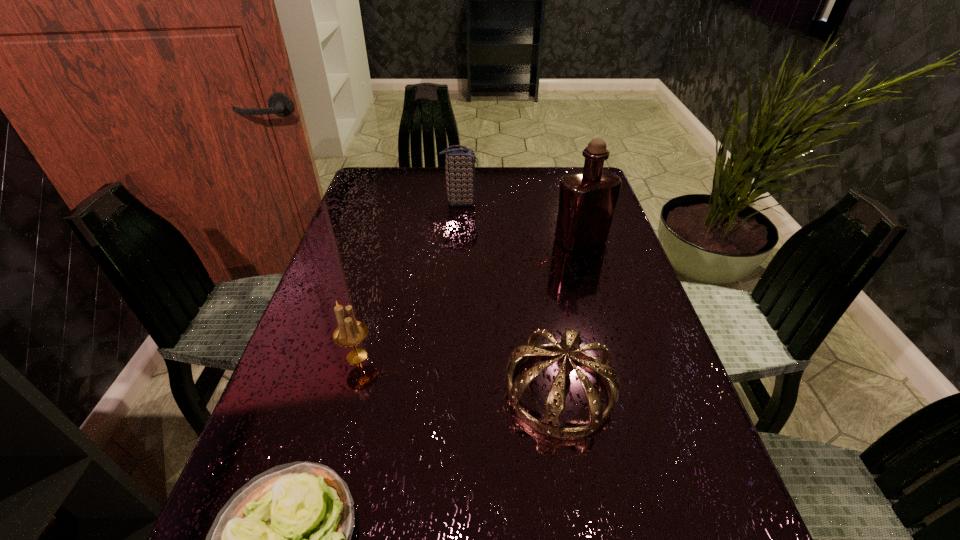
At what (x,y) coordinates should I click in order to perform the action: click on free spot between the third object from right to left and the second farthest object. Please return your answer as a coordinate pair (x, y). The width and height of the screenshot is (960, 540). Looking at the image, I should click on (520, 221).

Locate an element on the screen. This screenshot has width=960, height=540. empty location between the tiara and the candle holder is located at coordinates [458, 374].

Identify the location of empty space that is in between the clutch bag and the tiara. This screenshot has width=960, height=540. (510, 296).

Where is `vacant area that lies between the farthest object and the tallest object`? This screenshot has width=960, height=540. vacant area that lies between the farthest object and the tallest object is located at coordinates (520, 221).

Identify which object is the third nearest to the third object from right to left. Please provide its 2D coordinates. Your answer should be formatted as a tuple, i.e. [(x, y)], where the tuple contains the x and y coordinates of a point satisfying the conditions above.

[(549, 425)]

You are a GUI agent. You are given a task and a screenshot of the screen. Output one action in this format:
    pyautogui.click(x=<x>, y=<y>)
    Task: Click on the closest object relative to the candle holder
    
    Given the screenshot: What is the action you would take?
    pyautogui.click(x=283, y=539)

The width and height of the screenshot is (960, 540). In order to click on vacant area in the image that satisfies the following two spatial constraints: 1. on the back side of the tallest object; 2. on the right side of the tiara in this screenshot , I will do `click(536, 240)`.

Locate an element on the screen. free space that satisfies the following two spatial constraints: 1. with the zip open on the clutch bag; 2. on the left side of the fourth nearest object is located at coordinates (458, 240).

This screenshot has width=960, height=540. I want to click on vacant region that satisfies the following two spatial constraints: 1. on the front side of the tiara; 2. on the left side of the candle holder, so click(x=348, y=391).